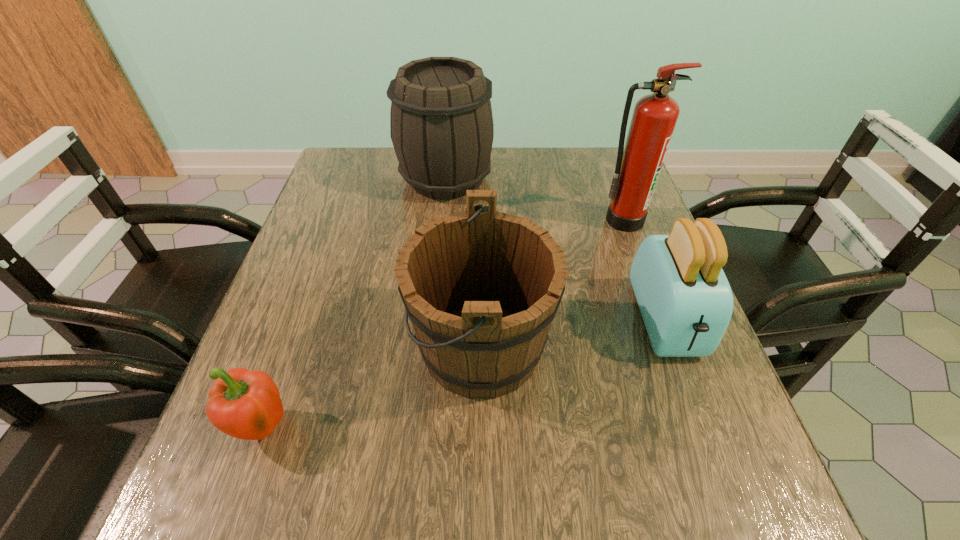
The image size is (960, 540). I want to click on vacant region located on the side of the nearer wine bucket with the handle for carrying, so [353, 347].

Identify the location of free space located on the side of the nearer wine bucket with the handle for carrying. The image size is (960, 540). (305, 347).

This screenshot has width=960, height=540. In order to click on vacant region located 0.160m on the side of the toaster with the lever in this screenshot , I will do `click(715, 455)`.

Image resolution: width=960 pixels, height=540 pixels. I want to click on free space located on the right of the leftmost object, so click(495, 429).

What are the coordinates of `object present at the far edge` in the screenshot? It's located at (441, 125).

Find the location of a particular element. Image resolution: width=960 pixels, height=540 pixels. object present at the left edge is located at coordinates pyautogui.click(x=244, y=404).

This screenshot has height=540, width=960. What are the coordinates of `fire extinguisher at the right edge` in the screenshot? It's located at (639, 163).

You are a GUI agent. You are given a task and a screenshot of the screen. Output one action in this format:
    pyautogui.click(x=<x>, y=<y>)
    Task: Click on the toaster situated at the right edge
    This screenshot has width=960, height=540.
    Given the screenshot: What is the action you would take?
    pyautogui.click(x=686, y=302)

In the image, there is a desktop. Where is `vacant area at the far edge`? vacant area at the far edge is located at coordinates (564, 165).

This screenshot has width=960, height=540. Identify the location of vacant space at the left edge of the desktop. (268, 361).